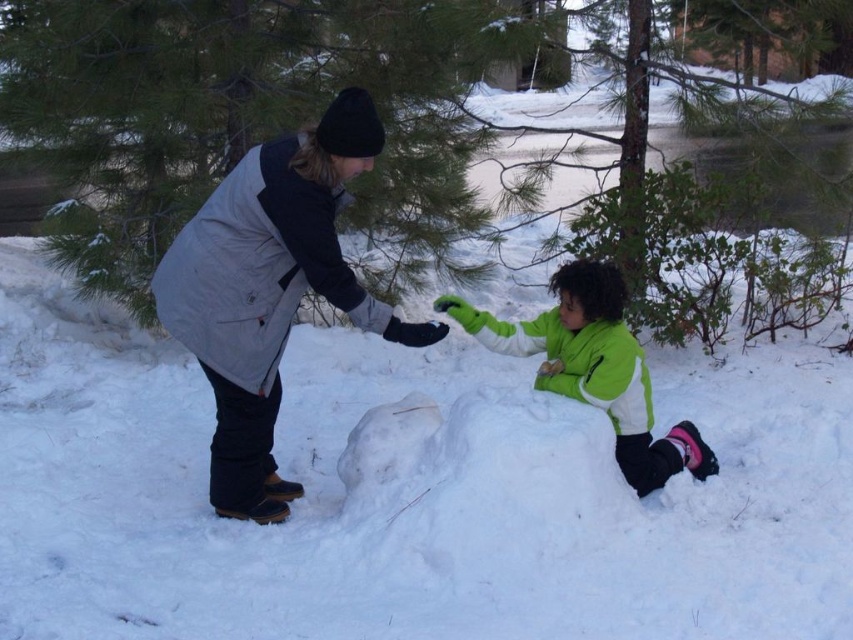
Question: Which point is farther to the camera?

Choices:
 (A) (338, 184)
 (B) (689, 454)

Answer: (B)

Question: Is gray fleece jacket at center positioned in front of green fleece jacket at lower center?

Choices:
 (A) no
 (B) yes

Answer: (B)

Question: Which of the following is the farthest from the observer?

Choices:
 (A) (212, 444)
 (B) (575, 349)

Answer: (B)

Question: Does gray fleece jacket at center have a smaller size compared to green fleece jacket at lower center?

Choices:
 (A) no
 (B) yes

Answer: (A)

Question: Is gray fleece jacket at center closer to camera compared to green fleece jacket at lower center?

Choices:
 (A) yes
 (B) no

Answer: (A)